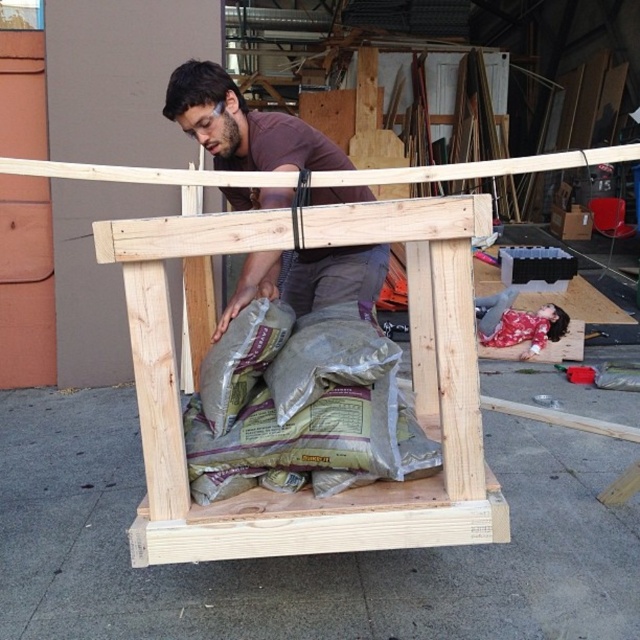
You are a construction worker observing the workshop scene. You notice the natural wood plank at center and the brown matte shirt at upper center. Which object occupies a larger area in the image?

The brown matte shirt at upper center is larger than the natural wood plank at center, so it occupies a larger area in the image.

You are an observer standing in front of the workshop scene. You notice the green fabric sacks at center and the brown matte shirt at upper center. Which object is shorter in height?

The green fabric sacks at center has a lesser height compared to the brown matte shirt at upper center, so the green fabric sacks at center is shorter.